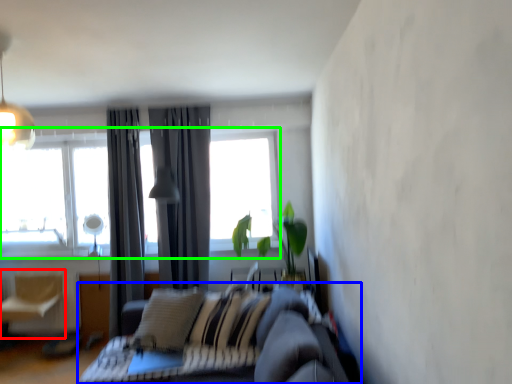
Question: Based on their relative distances, which object is farther from swivel chair (highlighted by a red box)? Choose from studio couch (highlighted by a blue box) and window (highlighted by a green box).

Choices:
 (A) studio couch
 (B) window

Answer: (A)